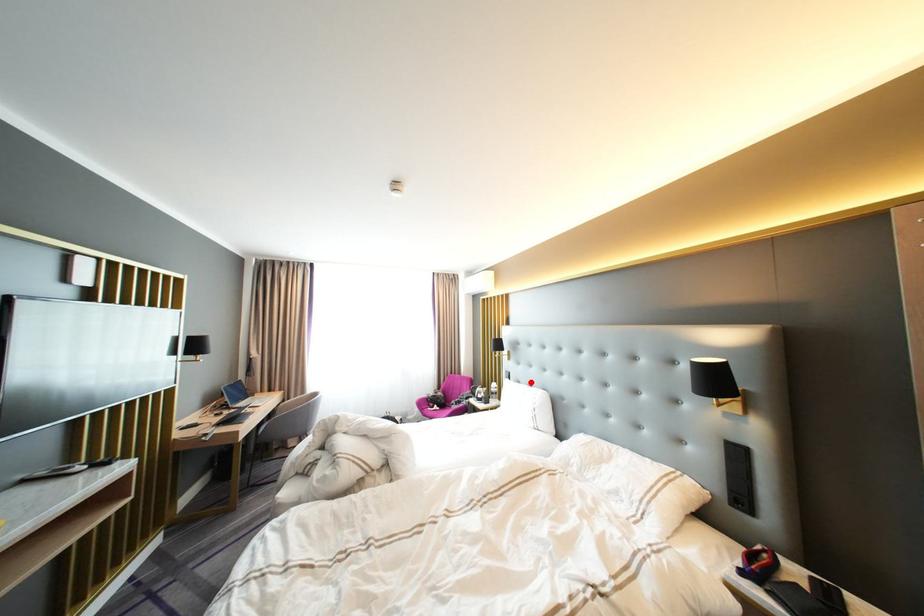
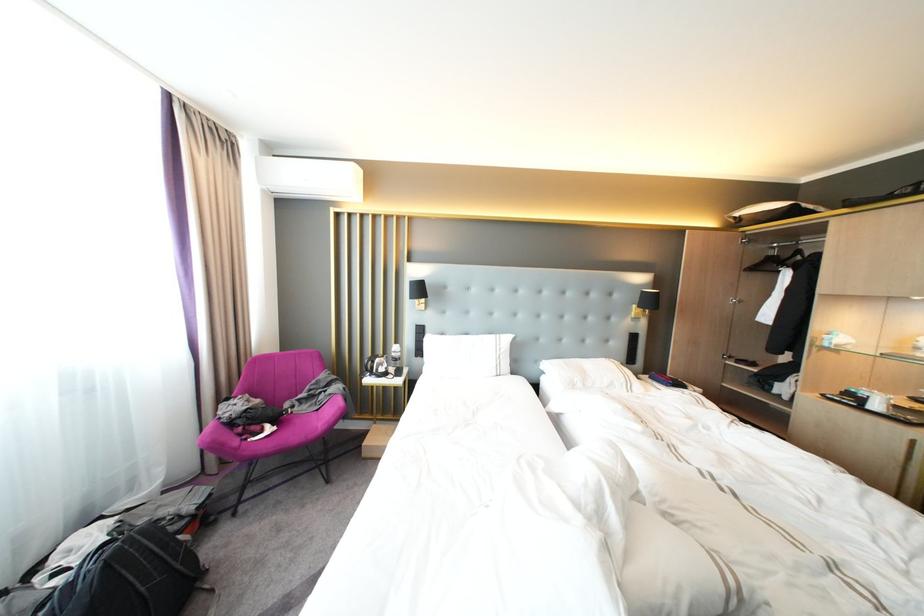
Question: I am providing you with two images of the same scene from different viewpoints. In image1, a red point is highlighted. Considering the same 3D point in image2, which of the following is correct?

Choices:
 (A) It is closer
 (B) It is farther

Answer: (A)